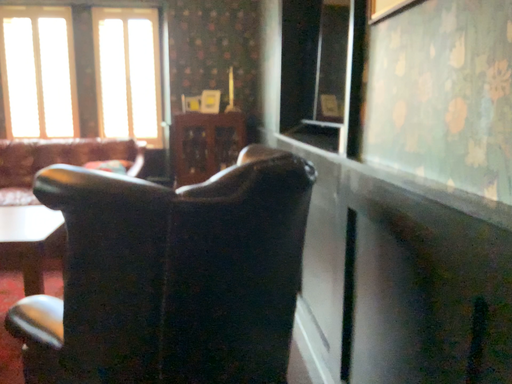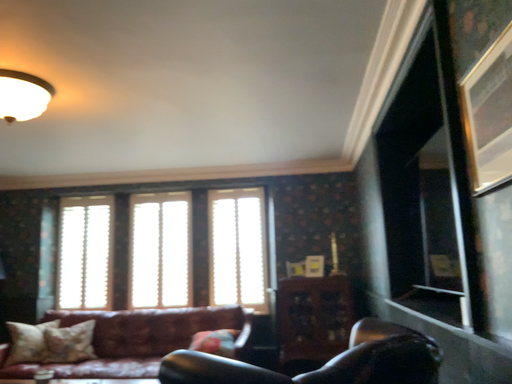
Question: Which way did the camera rotate in the video?

Choices:
 (A) rotated downward
 (B) rotated upward

Answer: (B)